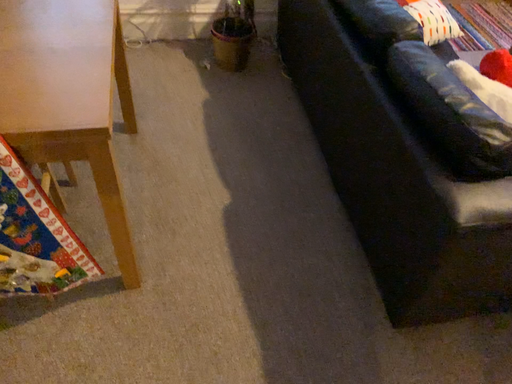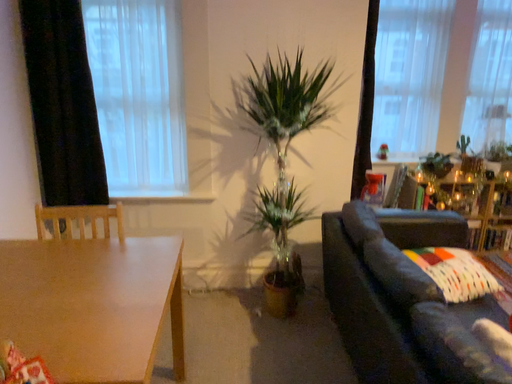
Question: Which way did the camera rotate in the video?

Choices:
 (A) rotated left
 (B) rotated right

Answer: (A)